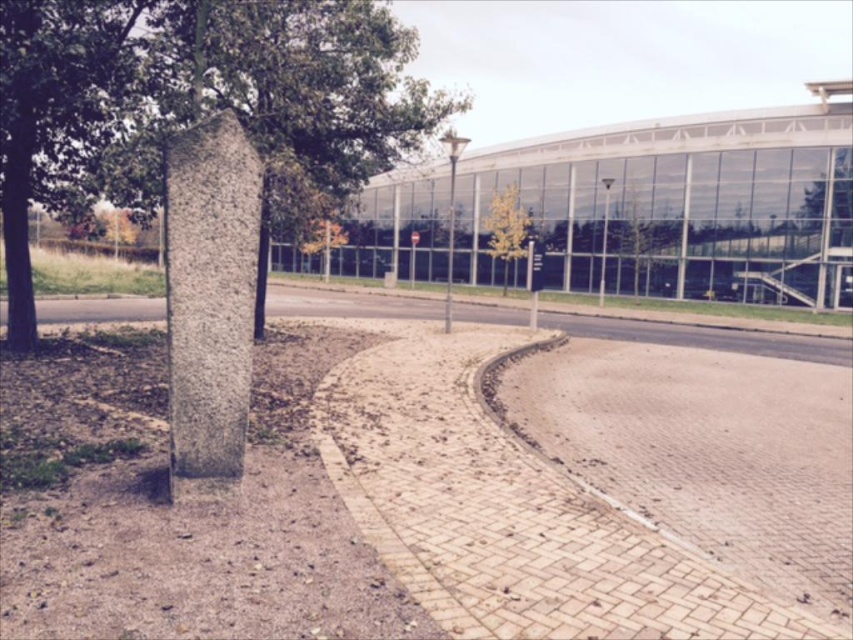
Question: Does green textured stone at left appear on the left side of yellow-green foliage at center?

Choices:
 (A) yes
 (B) no

Answer: (A)

Question: Which object is positioned closest to the brick paved sidewalk at center?

Choices:
 (A) green leafy tree at upper right
 (B) green textured stone at left
 (C) granite column at center
 (D) yellow-green foliage at center

Answer: (B)

Question: Is brick paved sidewalk at center below granite column at center?

Choices:
 (A) yes
 (B) no

Answer: (A)

Question: Which object is the farthest from the green leafy tree at upper right?

Choices:
 (A) brick paved sidewalk at center
 (B) green textured stone at left
 (C) granite column at center
 (D) yellow-green foliage at center

Answer: (C)

Question: Can you confirm if green textured stone at left is positioned to the right of granite column at center?

Choices:
 (A) yes
 (B) no

Answer: (B)

Question: Which object is closer to the camera taking this photo?

Choices:
 (A) green leafy tree at upper right
 (B) brick paved sidewalk at center

Answer: (B)